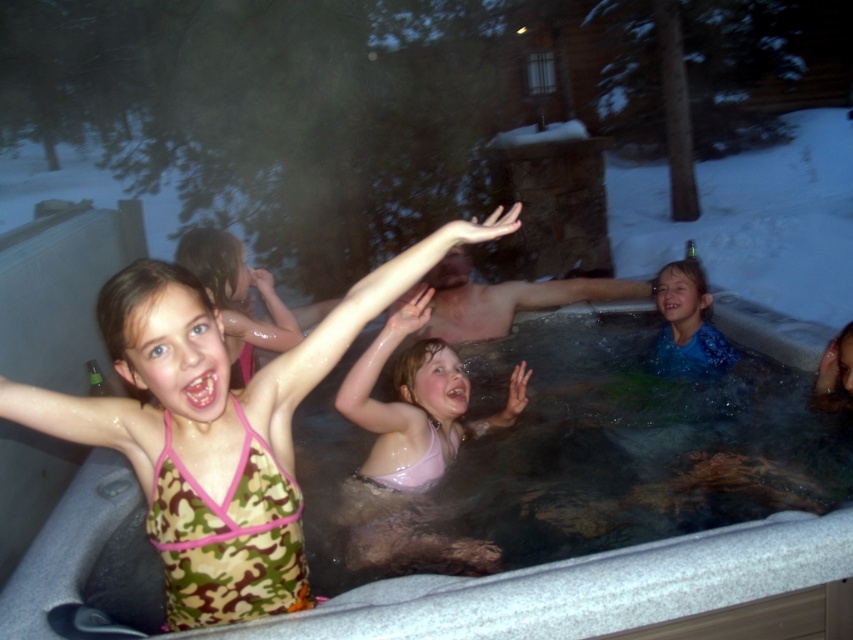
Does pink matte swimsuit at center come in front of blue patterned swimsuit at center?

That is True.

Who is lower down, pink matte swimsuit at center or blue patterned swimsuit at center?

Positioned lower is pink matte swimsuit at center.

What do you see at coordinates (416, 401) in the screenshot? I see `pink matte swimsuit at center` at bounding box center [416, 401].

At what (x,y) coordinates should I click in order to perform the action: click on pink matte swimsuit at center. Please return your answer as a coordinate pair (x, y). This screenshot has height=640, width=853. Looking at the image, I should click on (416, 401).

Who is positioned more to the right, white textured hot tub at center or pink matte swimsuit at center?

From the viewer's perspective, white textured hot tub at center appears more on the right side.

Between white textured hot tub at center and pink matte swimsuit at center, which one has less height?

With less height is white textured hot tub at center.

Between point (575, 586) and point (389, 486), which one is positioned in front?

Positioned in front is point (575, 586).

You are a GUI agent. You are given a task and a screenshot of the screen. Output one action in this format:
    pyautogui.click(x=<x>, y=<y>)
    Task: Click on the white textured hot tub at center
    This screenshot has height=640, width=853.
    Given the screenshot: What is the action you would take?
    pyautogui.click(x=589, y=588)

Which is in front, point (271, 340) or point (668, 332)?

Point (271, 340) is more forward.

Does point (218, 272) lie in front of point (676, 260)?

That is True.

Is point (242, 356) in front of point (694, 284)?

Yes, point (242, 356) is closer to viewer.

The image size is (853, 640). I want to click on camouflage fabric swimsuit at upper left, so click(x=236, y=298).